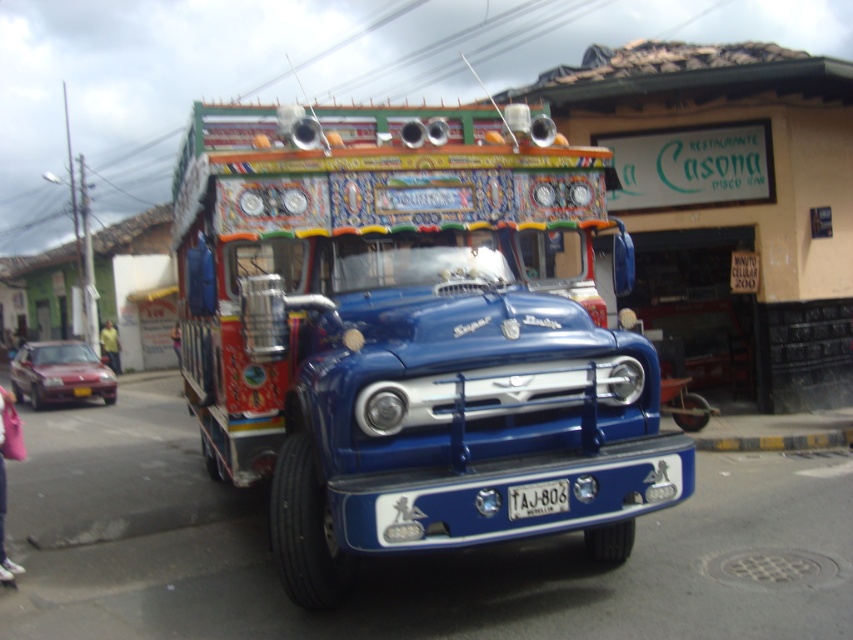
You are a delivery driver who needs to park your truck in a way that the white plastic license plate at center is visible from the street. Considering the yellow concrete curb at lower center, where should you position the truck relative to the curb?

The yellow concrete curb at lower center is positioned under the white plastic license plate at center, so to ensure the license plate is visible from the street, the truck should be parked such that the white plastic license plate at center is above the yellow concrete curb at lower center.

You are standing at the edge of the road and want to place a small flowerpot exactly where the yellow concrete curb at lower center is located. What are the coordinates where you should place it?

The coordinates for placing the flowerpot at the location of the yellow concrete curb at lower center are point (776, 442).

In the scene shown: You are a delivery person who needs to drive the shiny blue truck at center under a low bridge. The yellow concrete curb at lower center is at the same height as the bridge. Will the truck fit under the bridge?

The shiny blue truck at center is much taller than the yellow concrete curb at lower center, so it will not fit under the bridge which is at the same height as the curb.